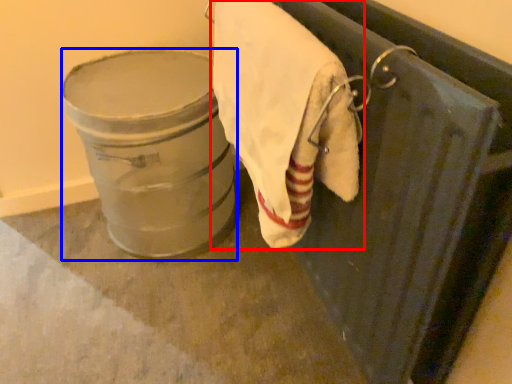
Question: Which object is closer to the camera taking this photo, towel (highlighted by a red box) or lift (highlighted by a blue box)?

Choices:
 (A) towel
 (B) lift

Answer: (A)